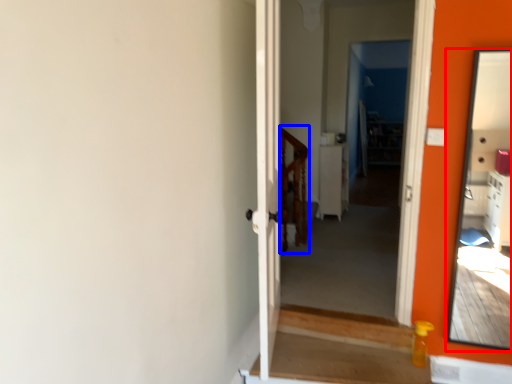
Question: Which point is further to the camera, mirror (highlighted by a red box) or balustrade (highlighted by a blue box)?

Choices:
 (A) mirror
 (B) balustrade

Answer: (B)